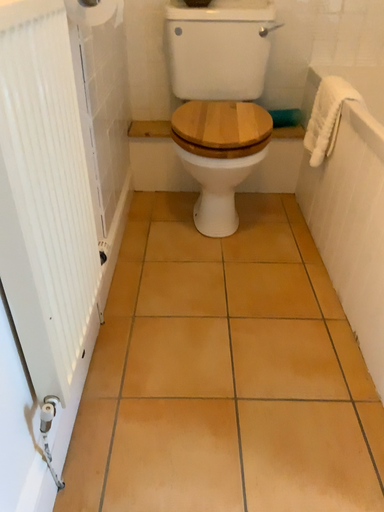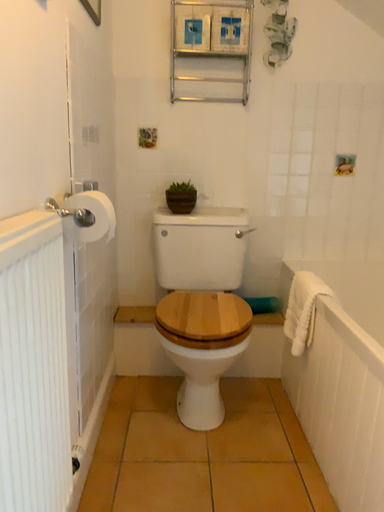
Question: Which way did the camera rotate in the video?

Choices:
 (A) rotated downward
 (B) rotated upward

Answer: (B)